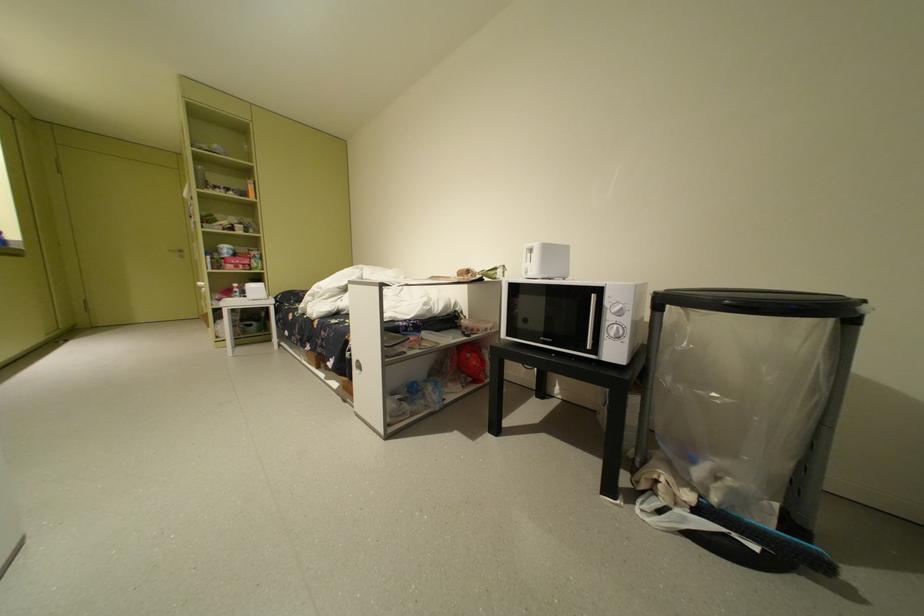
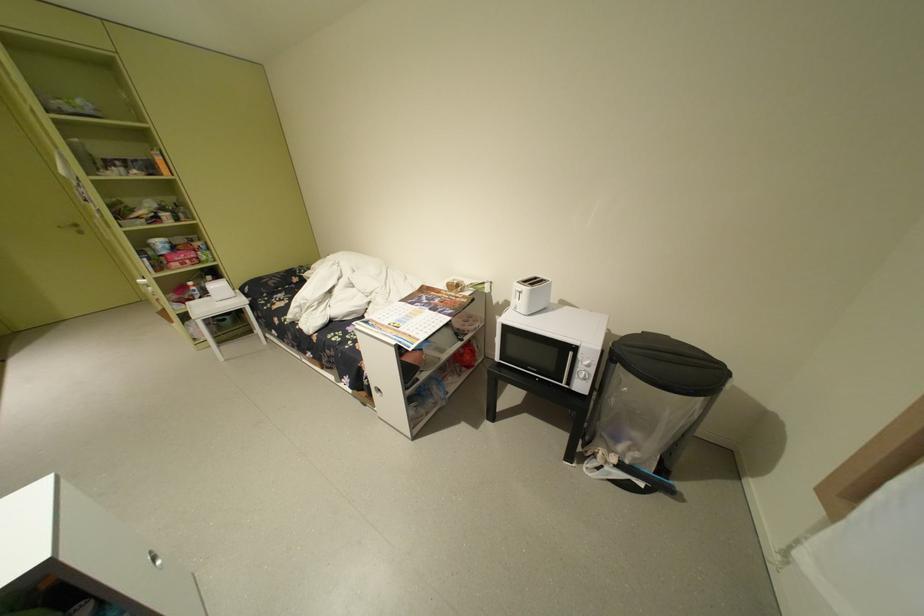
Find the pixel in the second image that matches [538,262] in the first image.

(527, 299)